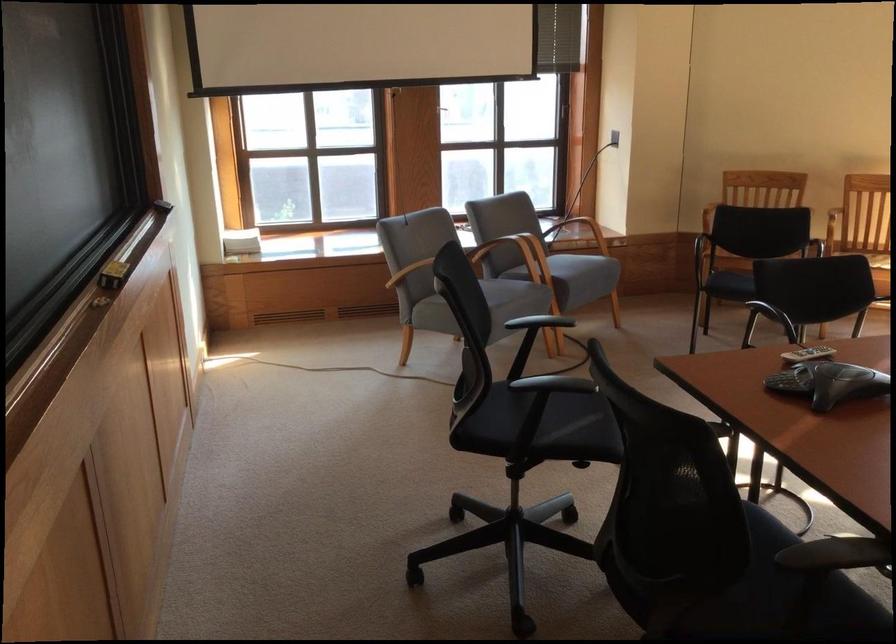
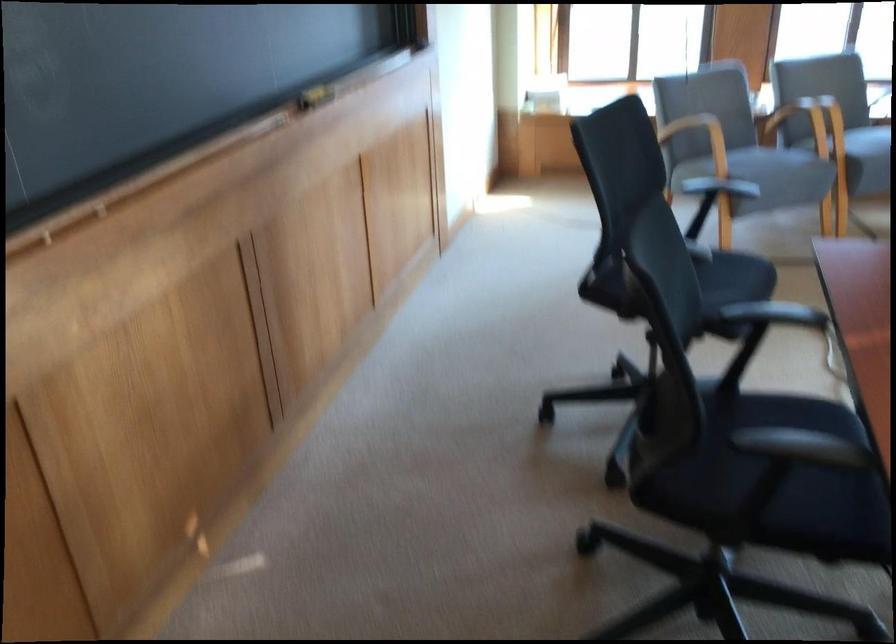
In the second image, find the point that corresponds to point (773, 574) in the first image.

(789, 477)